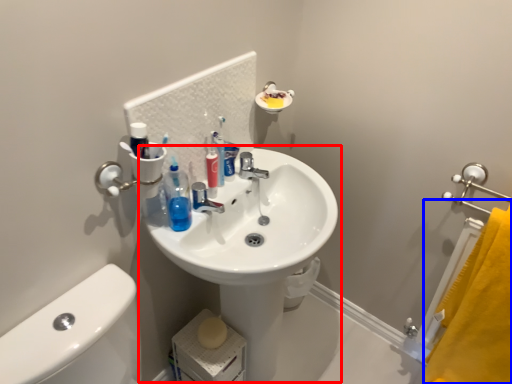
Question: Which object is closer to the camera taking this photo, sink (highlighted by a red box) or bath towel (highlighted by a blue box)?

Choices:
 (A) sink
 (B) bath towel

Answer: (A)